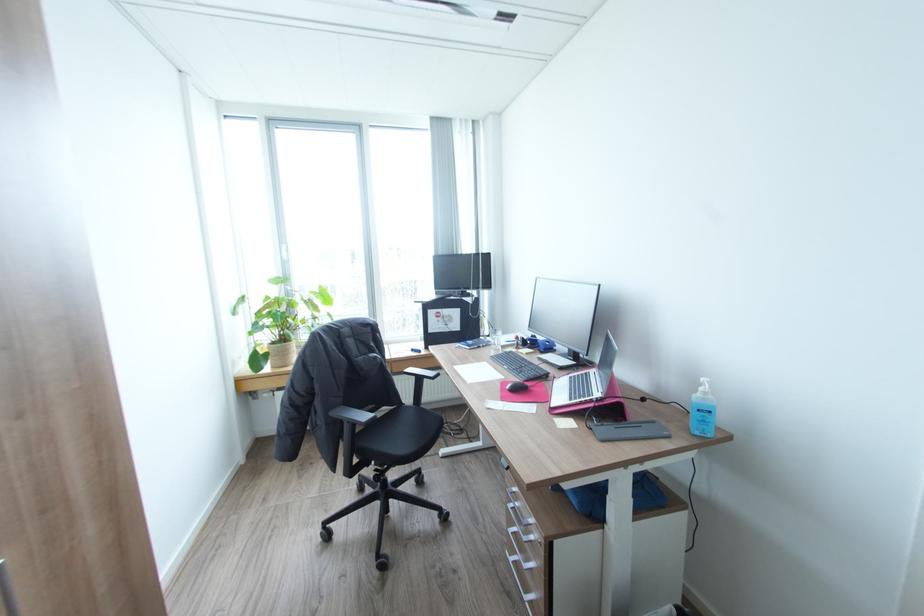
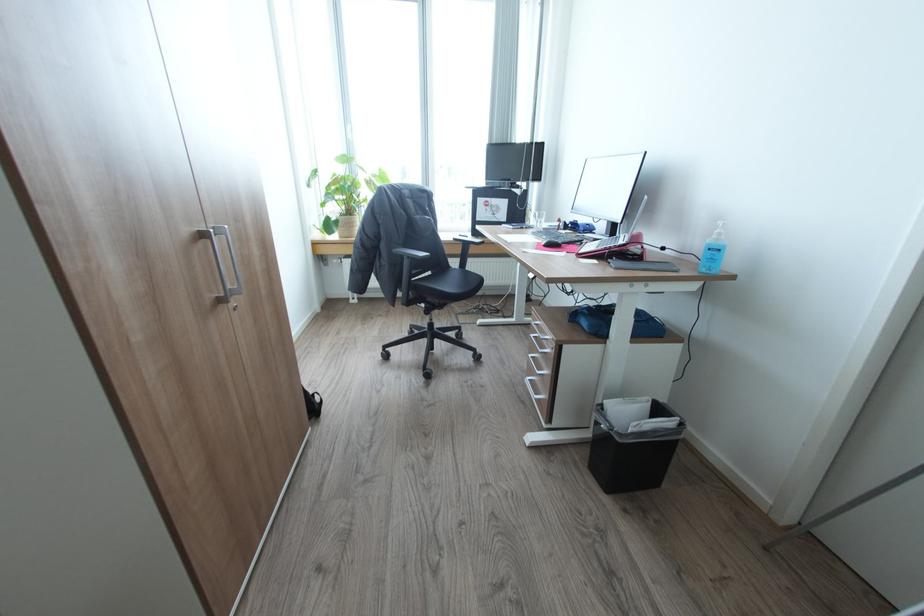
Question: The images are taken continuously from a first-person perspective. In which direction are you moving?

Choices:
 (A) Left
 (B) Right
 (C) Forward
 (D) Backward

Answer: (D)